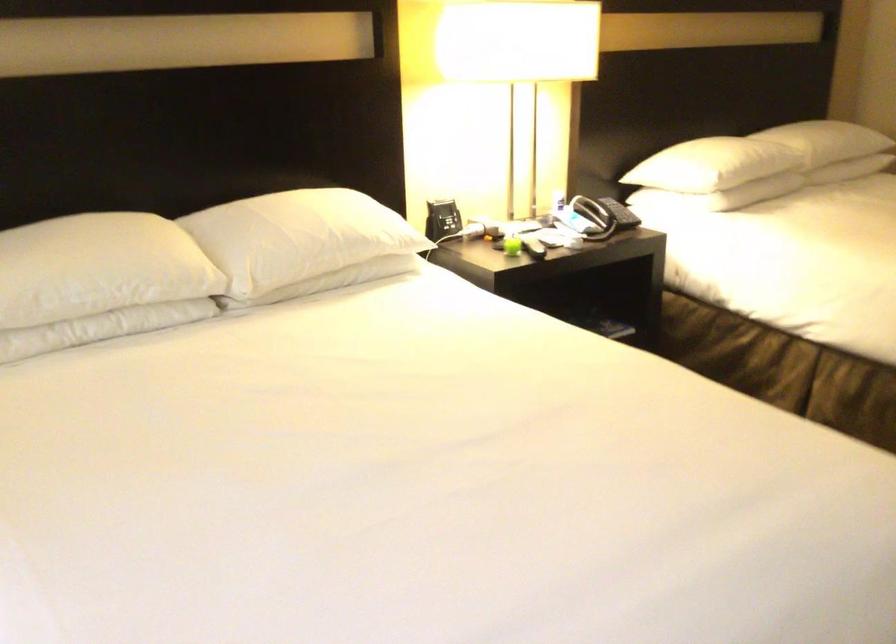
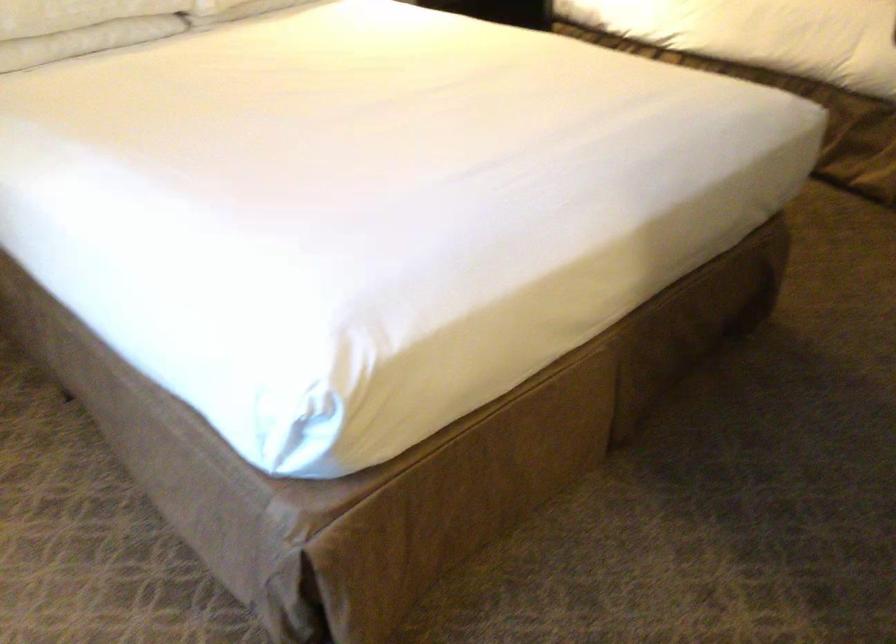
Find the pixel in the second image that matches (87,317) in the first image.

(81, 26)